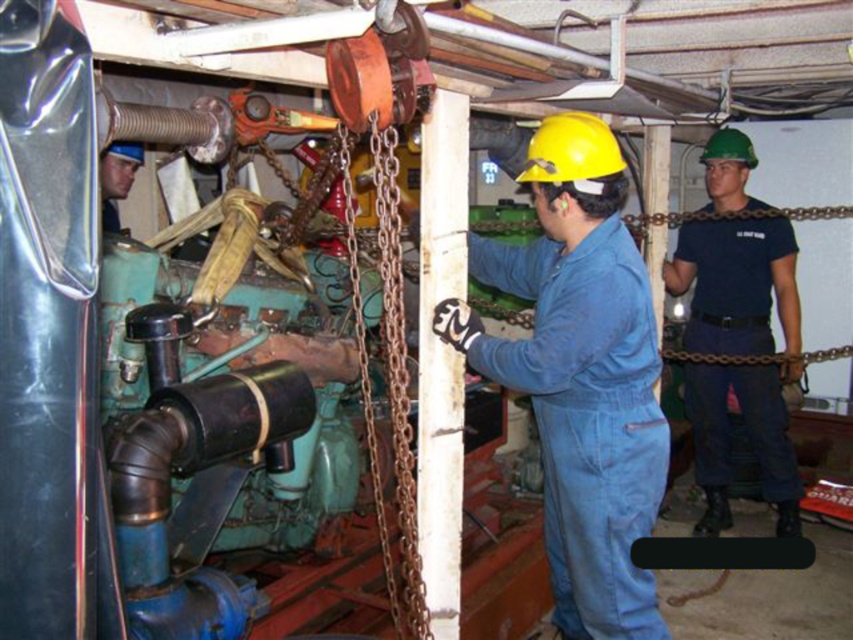
Question: Does dark blue uniform at center appear under matte black helmet at upper left?

Choices:
 (A) yes
 (B) no

Answer: (A)

Question: Based on their relative distances, which object is nearer to the matte black helmet at upper left?

Choices:
 (A) dark blue uniform at center
 (B) blue denim jumpsuit at center

Answer: (B)

Question: Which of these objects is positioned farthest from the matte black helmet at upper left?

Choices:
 (A) blue denim jumpsuit at center
 (B) dark blue uniform at center

Answer: (B)

Question: Can you confirm if dark blue uniform at center is positioned above matte black helmet at upper left?

Choices:
 (A) no
 (B) yes

Answer: (A)

Question: Where is dark blue uniform at center located in relation to matte black helmet at upper left in the image?

Choices:
 (A) right
 (B) left

Answer: (A)

Question: Estimate the real-world distances between objects in this image. Which object is closer to the dark blue uniform at center?

Choices:
 (A) matte black helmet at upper left
 (B) blue denim jumpsuit at center

Answer: (B)